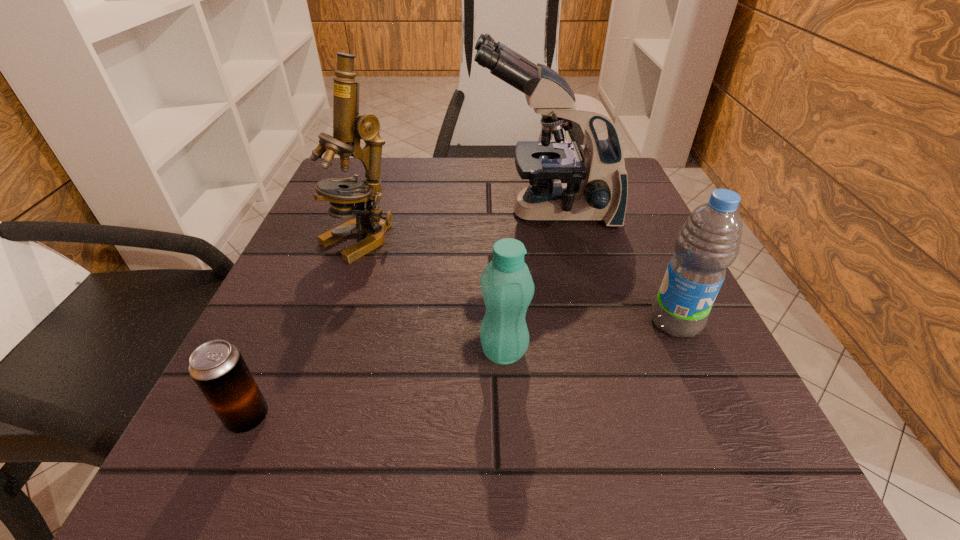
Image resolution: width=960 pixels, height=540 pixels. I want to click on free space at the near edge, so click(x=402, y=507).

Where is `vacant space at the left edge of the desktop`? This screenshot has width=960, height=540. vacant space at the left edge of the desktop is located at coordinates (284, 280).

In the image, there is a desktop. Where is `blank space at the right edge`? blank space at the right edge is located at coordinates (596, 279).

Where is `free space at the near left corner of the desktop`? free space at the near left corner of the desktop is located at coordinates (230, 454).

The height and width of the screenshot is (540, 960). In order to click on vacant space at the near right corner of the desktop in this screenshot , I will do click(745, 479).

This screenshot has width=960, height=540. Find the location of `empty location between the nearest object and the fourth tallest object`. empty location between the nearest object and the fourth tallest object is located at coordinates (376, 384).

At what (x,y) coordinates should I click in order to perform the action: click on free spot between the bottle and the water bottle. Please return your answer as a coordinate pair (x, y). Image resolution: width=960 pixels, height=540 pixels. Looking at the image, I should click on (589, 336).

The width and height of the screenshot is (960, 540). What are the coordinates of `free space between the bottle and the left microscope` in the screenshot? It's located at (431, 296).

What are the coordinates of `vacant area that lies between the second shortest object and the water bottle` in the screenshot? It's located at (589, 336).

Locate an element on the screen. free point between the left microscope and the right microscope is located at coordinates (452, 226).